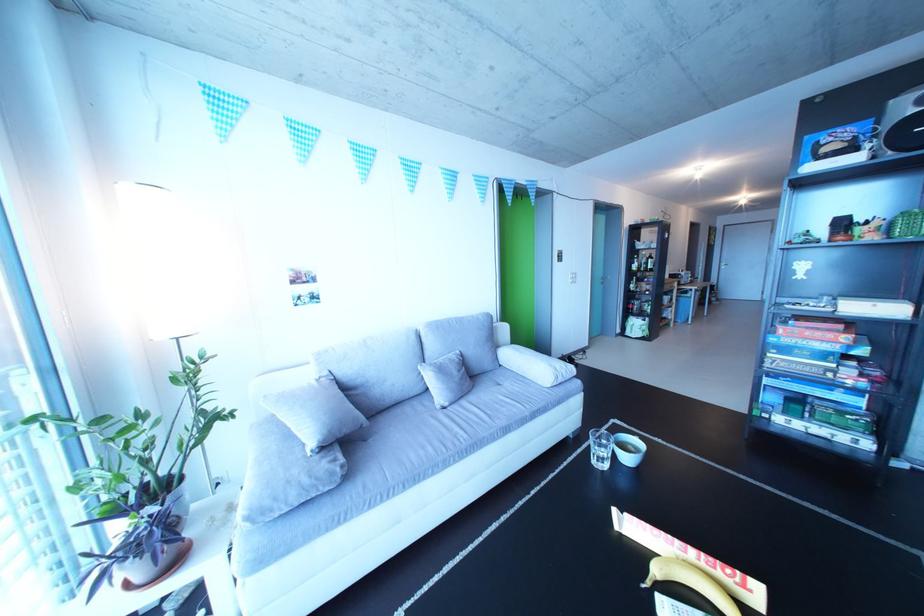
The height and width of the screenshot is (616, 924). I want to click on sofa armrest, so click(x=515, y=358).